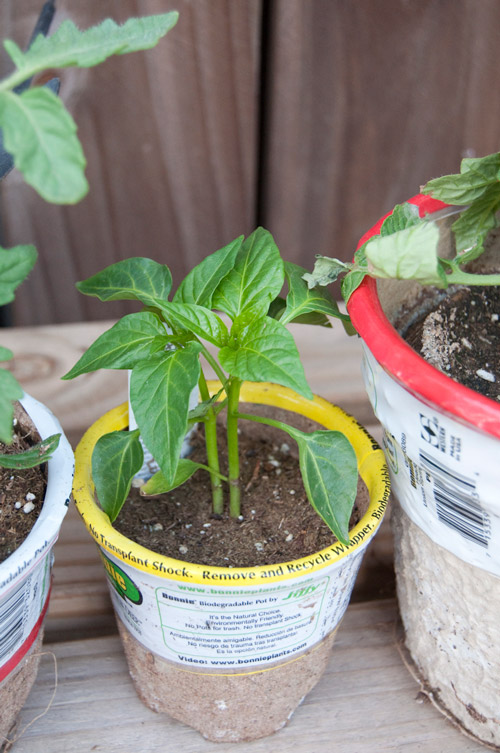
Locate an element on the screen. planter in the middle is located at coordinates (249, 697).